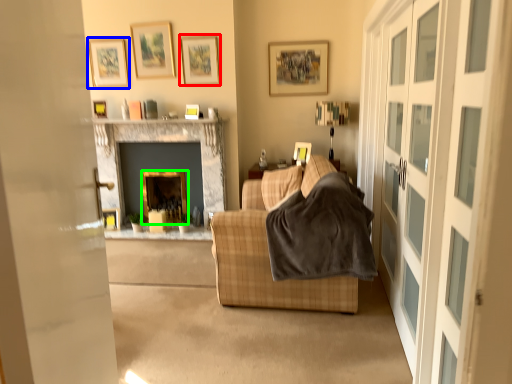
Question: Which is farther away from picture frame (highlighted by a red box)? picture frame (highlighted by a blue box) or fireplace (highlighted by a green box)?

Choices:
 (A) picture frame
 (B) fireplace

Answer: (B)